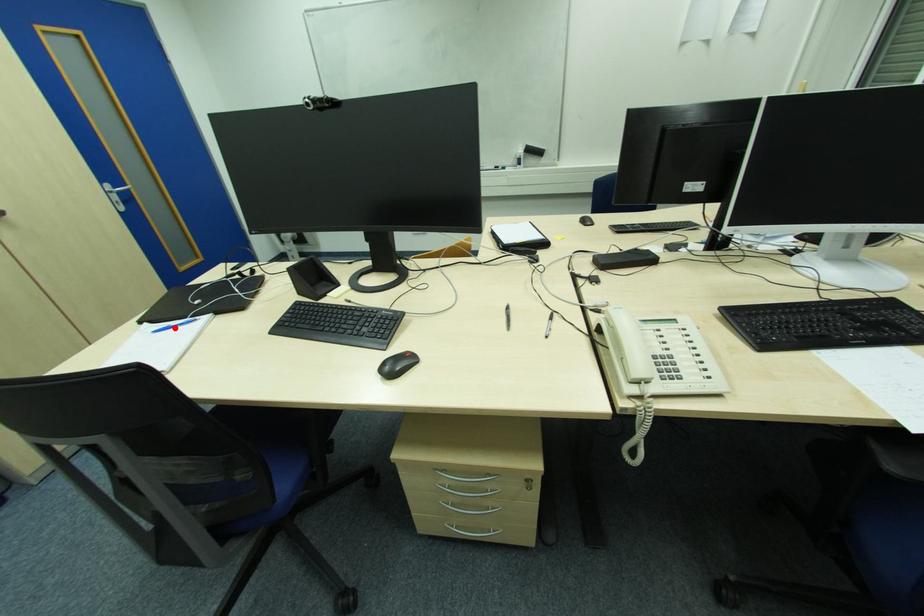
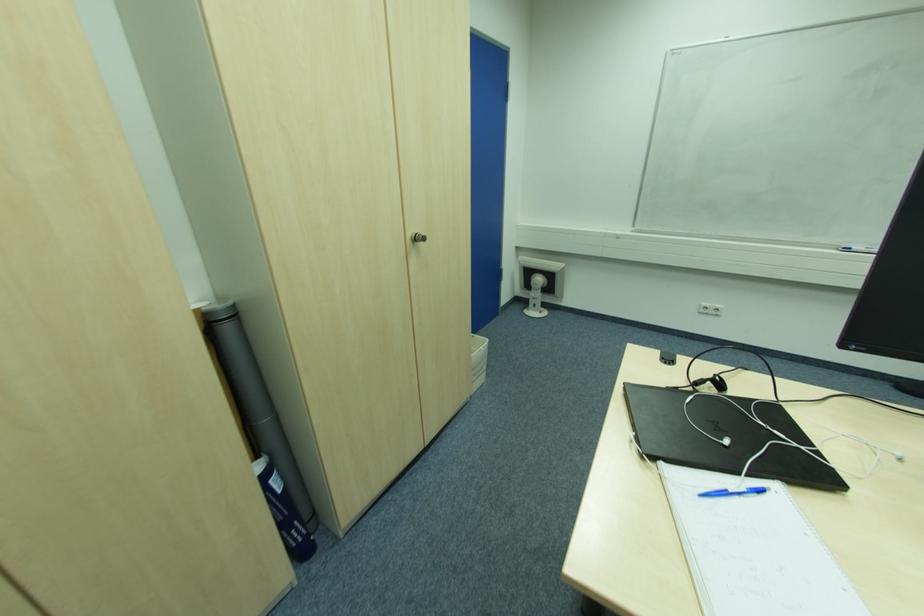
In the second image, find the point that corresponds to the highlighted location in the first image.

(727, 493)